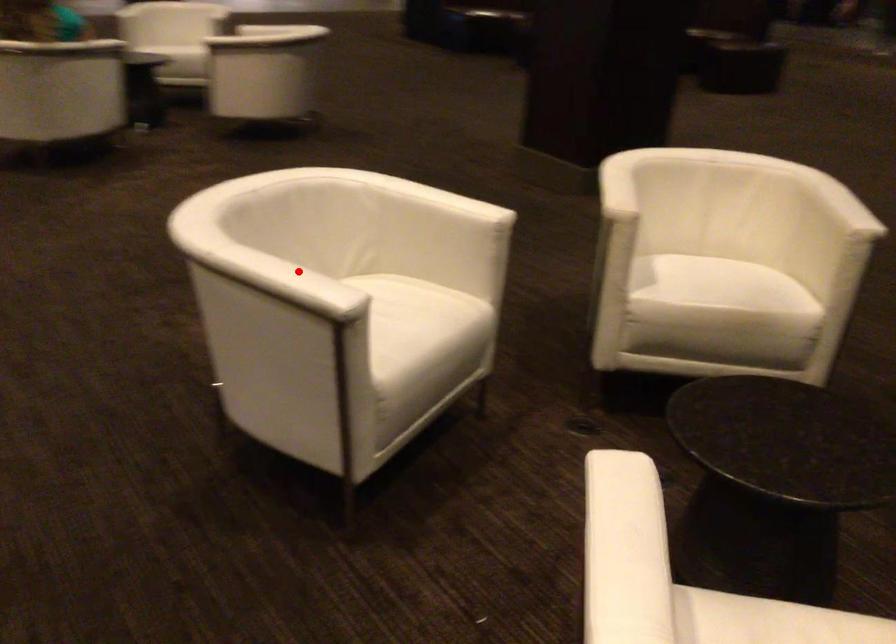
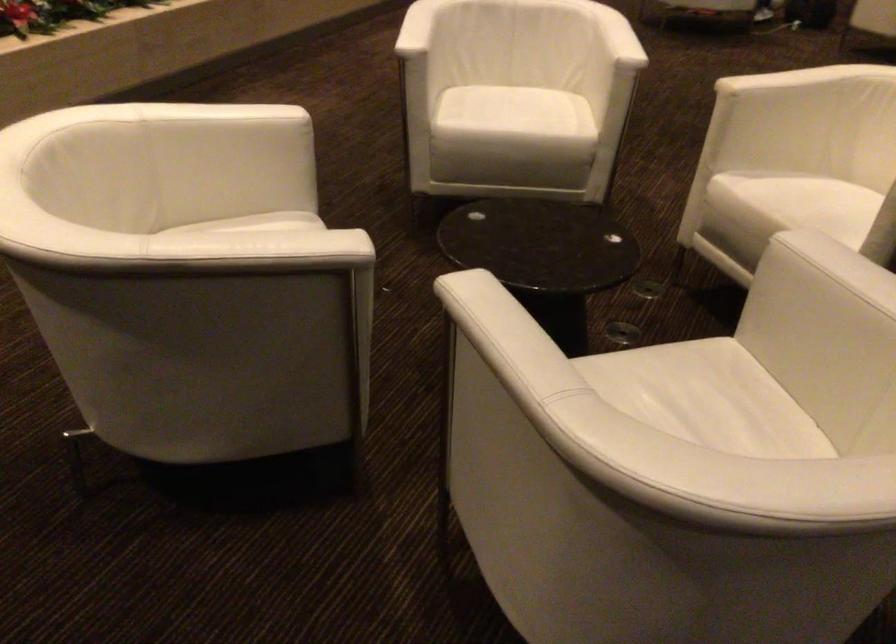
Locate, in the second image, the point that corresponds to the highlighted location in the first image.

(417, 28)